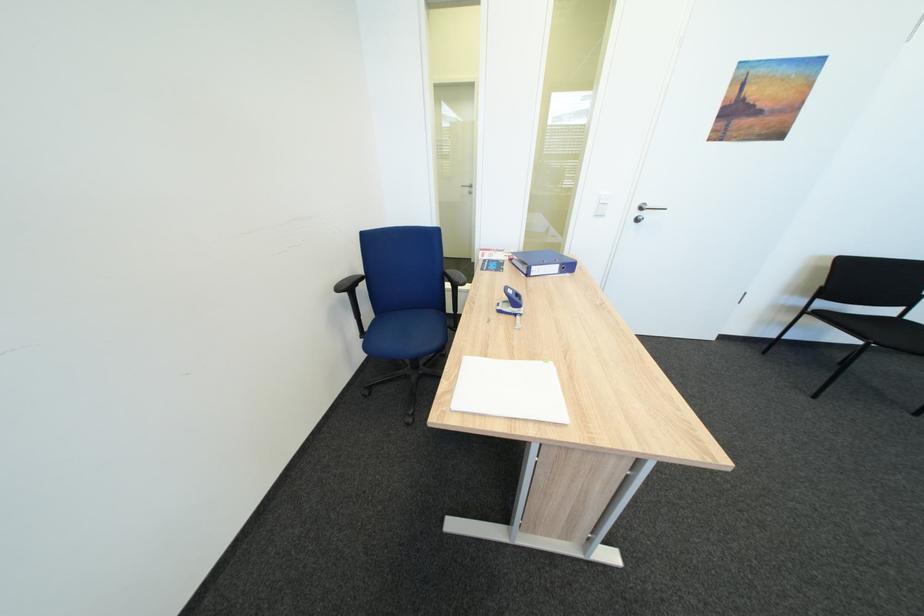
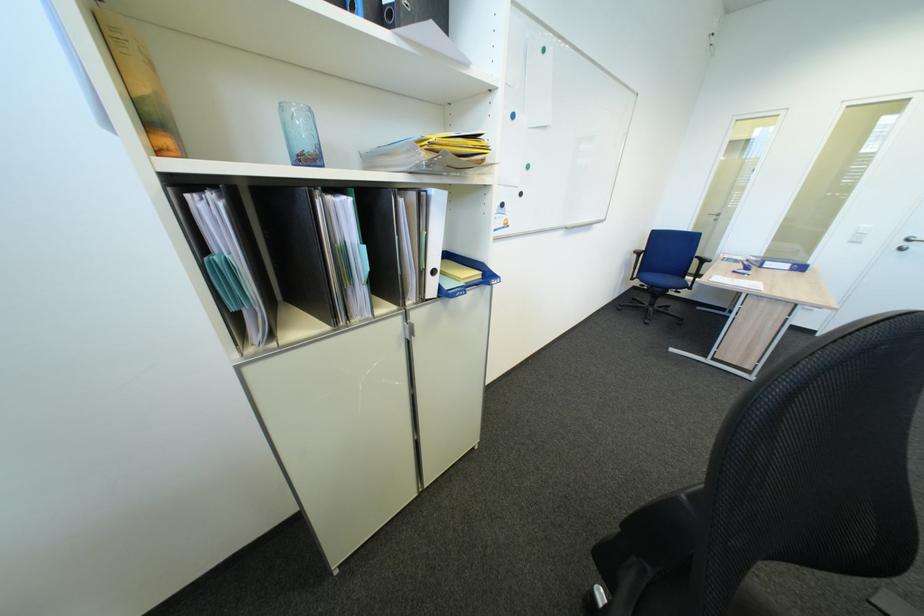
Locate, in the second image, the point that corresponds to pixel 650 209 in the first image.

(918, 241)